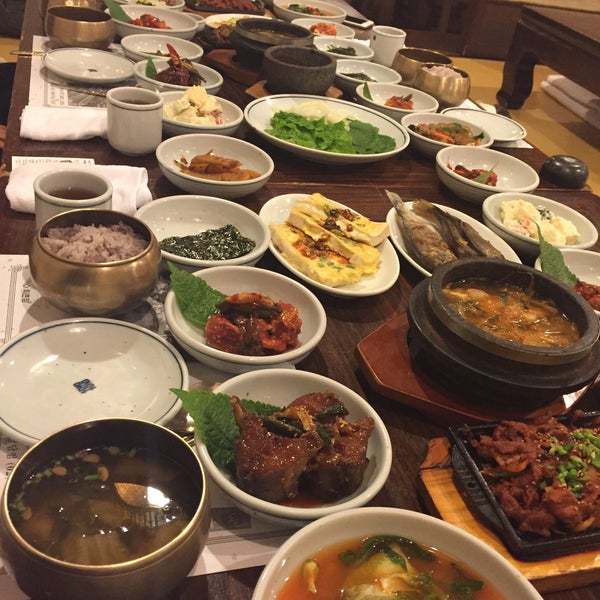
Find the location of a particular element. The width and height of the screenshot is (600, 600). placemat is located at coordinates (16, 298).